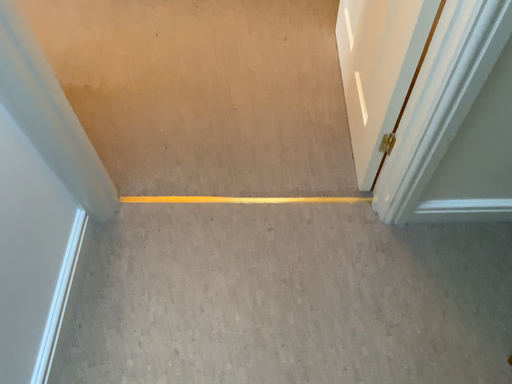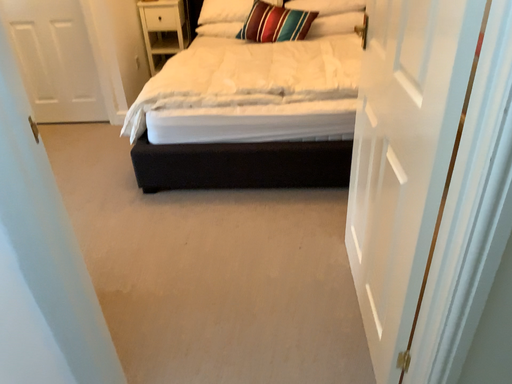
Question: How did the camera likely rotate when shooting the video?

Choices:
 (A) rotated upward
 (B) rotated downward

Answer: (A)